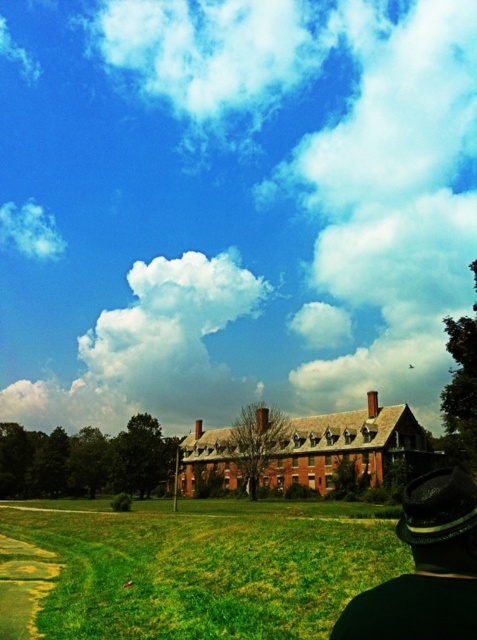
Between point (70, 515) and point (449, 557), which one is positioned in front?

Point (449, 557) is in front.

From the picture: Does green grass at lower center lie behind black felt hat at lower right?

Yes, green grass at lower center is behind black felt hat at lower right.

Between point (148, 600) and point (449, 630), which one is positioned in front?

Point (449, 630) is in front.

Find the location of `green grass at lower center`. green grass at lower center is located at coordinates (206, 566).

Does black felt hat at lower right appear over white fluffy cloud at upper left?

No, black felt hat at lower right is not above white fluffy cloud at upper left.

Who is more distant from viewer, (x=436, y=474) or (x=0, y=228)?

Positioned behind is point (x=0, y=228).

You are a GUI agent. You are given a task and a screenshot of the screen. Output one action in this format:
    pyautogui.click(x=<x>, y=<y>)
    Task: Click on the black felt hat at lower right
    
    Given the screenshot: What is the action you would take?
    pyautogui.click(x=425, y=568)

Does green grass at lower center lie in front of white fluffy cloud at upper left?

Yes, it is in front of white fluffy cloud at upper left.

Does point (258, 636) come closer to viewer compared to point (14, 230)?

That is True.

Identify the location of green grass at lower center. This screenshot has width=477, height=640. (206, 566).